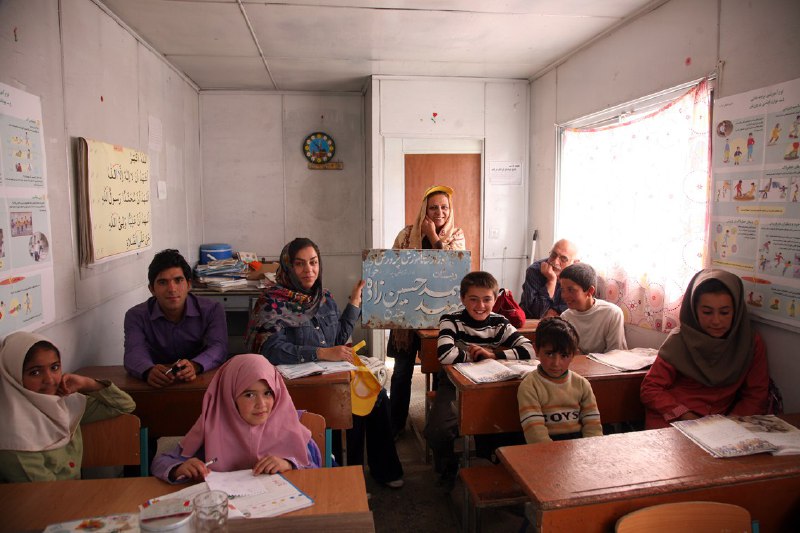
Locate an element on the screen. clock is located at coordinates (320, 149).